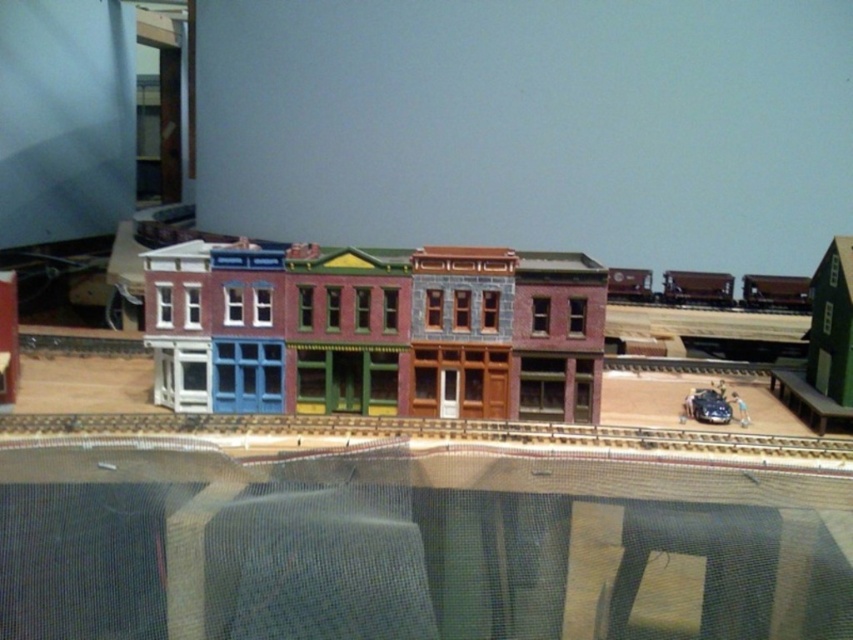
Question: Which object is positioned closest to the metallic silver train track at center?

Choices:
 (A) brown matte train car at center
 (B) shiny silver train car at center
 (C) multicolored painted building at center

Answer: (C)

Question: Does multicolored painted building at center appear on the left side of brown matte train car at center?

Choices:
 (A) no
 (B) yes

Answer: (B)

Question: Which is farther from the shiny silver train car at center?

Choices:
 (A) multicolored painted building at center
 (B) metallic silver train track at center
 (C) brown matte train car at center

Answer: (A)

Question: In this image, where is multicolored painted building at center located relative to brown matte train car at center?

Choices:
 (A) above
 (B) below

Answer: (B)

Question: Is metallic silver train track at center bigger than shiny silver train car at center?

Choices:
 (A) yes
 (B) no

Answer: (A)

Question: Which of the following is the closest to the observer?

Choices:
 (A) (724, 278)
 (B) (584, 433)
 (C) (264, 374)
 (D) (708, 397)

Answer: (B)